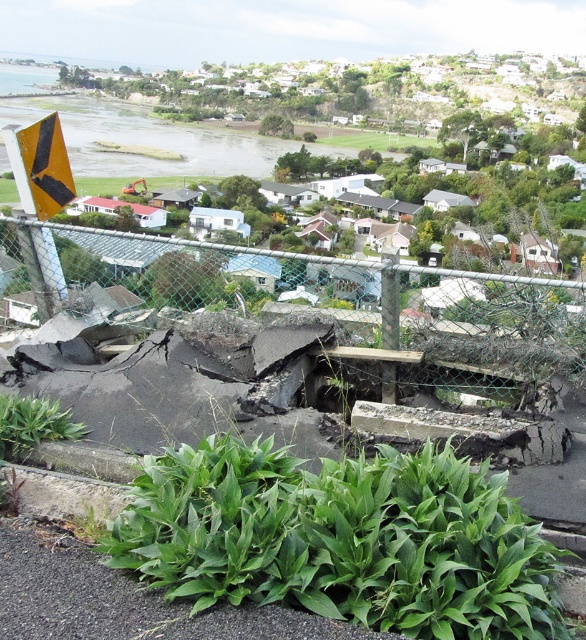
Is green leafy plant at lower center below yellow matte triangle at upper left?

Correct, green leafy plant at lower center is located below yellow matte triangle at upper left.

The image size is (586, 640). I want to click on green leafy plant at lower center, so [x=342, y=540].

The image size is (586, 640). I want to click on green leafy plant at lower center, so click(x=342, y=540).

In the scene shown: Who is more distant from viewer, (219, 545) or (229, 356)?

The point (229, 356) is behind.

Is point (284, 582) behind point (393, 348)?

That is False.

Identify the location of green leafy plant at lower center. Image resolution: width=586 pixels, height=640 pixels. tap(342, 540).

Which is in front, point (323, 324) or point (49, 120)?

Point (323, 324) is more forward.

Between wire mesh fence at center and yellow matte triangle at upper left, which one appears on the left side from the viewer's perspective?

From the viewer's perspective, yellow matte triangle at upper left appears more on the left side.

Who is more distant from viewer, (434, 344) or (57, 115)?

The point (57, 115) is more distant.

Image resolution: width=586 pixels, height=640 pixels. Identify the location of wire mesh fence at center. (505, 336).